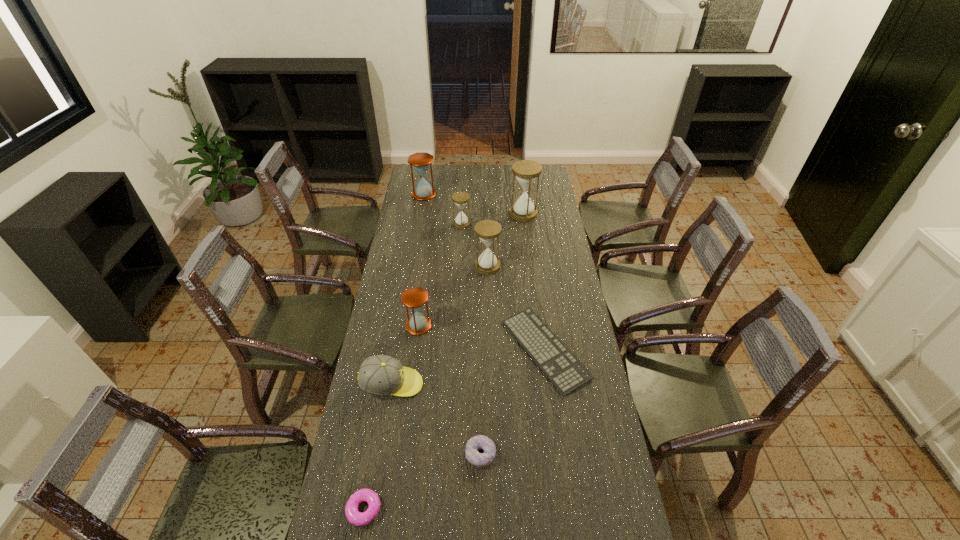
I want to click on vacant space at the far edge, so click(463, 171).

You are a GUI agent. You are given a task and a screenshot of the screen. Output one action in this format:
    pyautogui.click(x=<x>, y=<y>)
    Task: Click on the vacant space at the left edge of the desktop
    The height and width of the screenshot is (540, 960).
    Given the screenshot: What is the action you would take?
    pyautogui.click(x=414, y=219)

The width and height of the screenshot is (960, 540). Identify the location of vacant position at the right edge of the desktop. (578, 397).

At what (x,y) coordinates should I click in order to perform the action: click on free spot between the nearer brown hourglass and the tallest hourglass. Please return your answer as a coordinate pair (x, y). Looking at the image, I should click on (471, 269).

Image resolution: width=960 pixels, height=540 pixels. I want to click on free spot between the nearer doughnut and the farther brown hourglass, so click(395, 352).

Identify the location of free spot between the nearest hourglass and the yellow baseball cap. The height and width of the screenshot is (540, 960). (405, 355).

The image size is (960, 540). In order to click on vacant space that's between the computer keyboard and the left doughnut in this screenshot , I will do `click(454, 429)`.

This screenshot has height=540, width=960. I want to click on unoccupied position between the right doughnut and the computer keyboard, so click(x=513, y=402).

Identify the location of empty location between the bigger brown hourglass and the rightmost white hourglass. This screenshot has height=540, width=960. (473, 204).

The image size is (960, 540). I want to click on vacant space that's between the rightmost white hourglass and the pink doughnut, so click(x=444, y=361).